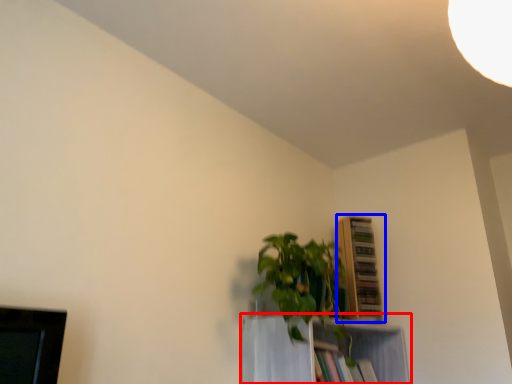
Question: Which point is closer to the camera, shelf (highlighted by a red box) or shelf (highlighted by a blue box)?

Choices:
 (A) shelf
 (B) shelf

Answer: (A)